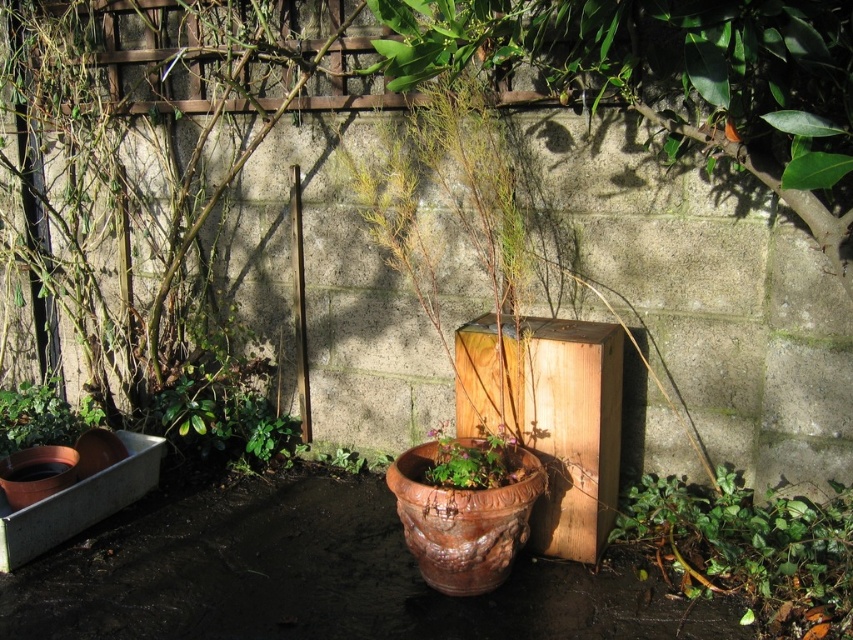
You are a gardener who needs to determine which object is taller between the green leafy plant at lower right and the matte brown pot at lower left. Based on the scene, which one is taller?

The green leafy plant at lower right is taller than the matte brown pot at lower left according to the description.

You are a gardener who wants to place a new statue that is 1 meter tall in the garden corner. The statue needs to be placed where it won not block the sunlight of the green leafy plant at lower right and the terracotta pot at center. Considering their heights, where should you place the statue?

The green leafy plant at lower right is taller than the terracotta pot at center. To ensure the statue does not block sunlight for both, place the statue behind the green leafy plant at lower right since it is taller and can cast a shadow only on itself, but the shorter terracotta pot at center would still receive sunlight from other directions.